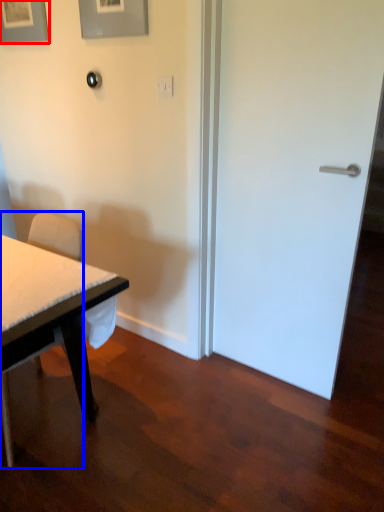
Question: Which object is further to the camera taking this photo, picture frame (highlighted by a red box) or chair (highlighted by a blue box)?

Choices:
 (A) picture frame
 (B) chair

Answer: (A)